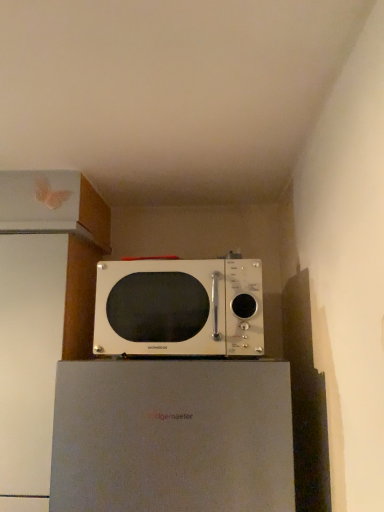
What do you see at coordinates (179, 308) in the screenshot? The height and width of the screenshot is (512, 384). I see `white glossy microwave at center` at bounding box center [179, 308].

Identify the location of white glossy microwave at center. The height and width of the screenshot is (512, 384). (179, 308).

In order to face white glossy microwave at center, should I rotate leftwards or rightwards?

To face it directly, rotate left by 1.311 degrees.

This screenshot has height=512, width=384. Identify the location of white glossy microwave at center. (179, 308).